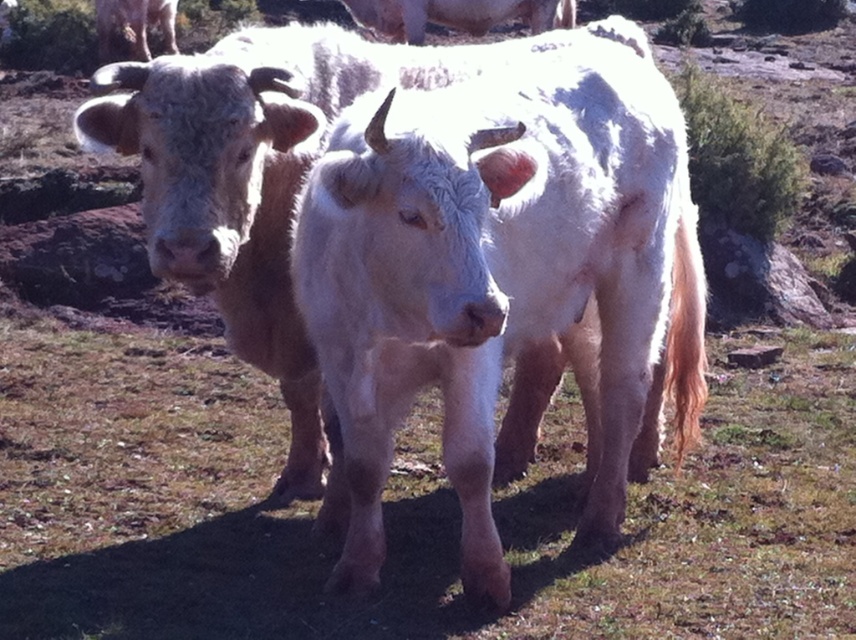
Does green grass at center appear on the right side of white woolly cow at center?

Correct, you'll find green grass at center to the right of white woolly cow at center.

Does point (296, 572) lie in front of point (657, 268)?

That is True.

The width and height of the screenshot is (856, 640). Identify the location of green grass at center. (401, 509).